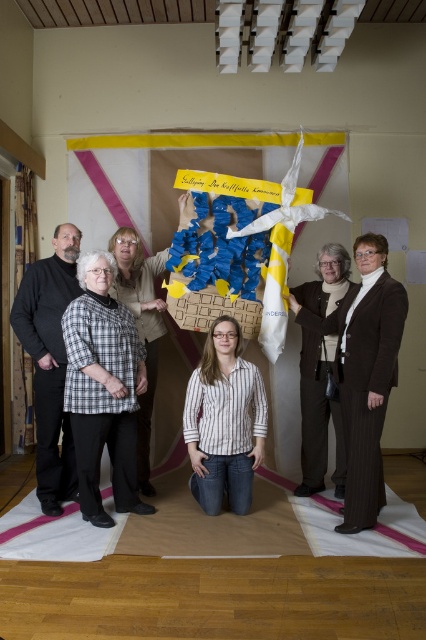
You are a photographer trying to adjust the focus on your camera. You notice two items at the center of the image, the brown woolen sweater at center and the striped shirt at center. Which one should you focus on first if you want to ensure the taller item is in focus first?

The striped shirt at center is taller than the brown woolen sweater at center, so you should focus on the striped shirt at center first.

You are a photographer standing in front of the group. You notice the black matte shirt at left and the striped shirt at center. Which shirt is positioned higher in the image?

The black matte shirt at left is located above the striped shirt at center in the image.

You are a photographer standing in front of the group. You want to ensure that the two central figures wearing the brown woolen sweater at center and the striped shirt at center are positioned close enough for a group photo. The minimum recommended distance between subjects for clear focus is 1 meter. Based on the scene, will these two items meet the focus requirement?

The distance between the brown woolen sweater at center and the striped shirt at center is 97.80 centimeters, which is less than the 1 meter requirement. Therefore, they are positioned close enough for a group photo with clear focus.